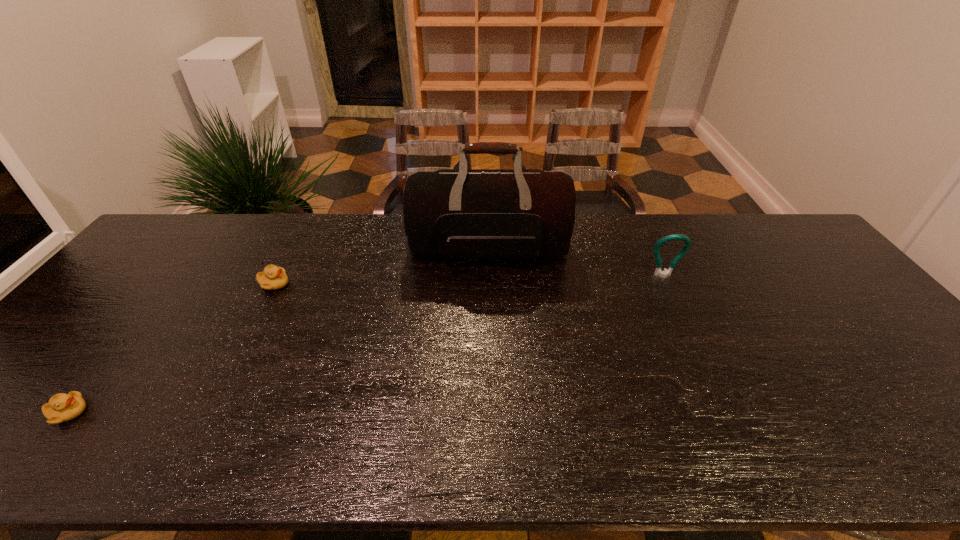
Find the location of a particular element. The height and width of the screenshot is (540, 960). free location at the far right corner of the desktop is located at coordinates (810, 255).

The image size is (960, 540). In order to click on free space between the leftmost object and the second tallest object in this screenshot , I will do `click(366, 345)`.

Identify the location of free space between the nearest object and the second tallest object. The image size is (960, 540). (366, 345).

Locate an element on the screen. Image resolution: width=960 pixels, height=540 pixels. blank region between the farther duckling and the nearer duckling is located at coordinates (171, 348).

Identify the location of free point between the bottle opener and the duffel bag. The image size is (960, 540). (576, 262).

Find the location of a particular element. free point between the tallest object and the right duckling is located at coordinates (382, 266).

Identify the location of vacant space that's between the second tallest object and the leftmost object. (366, 345).

This screenshot has width=960, height=540. Identify the location of empty space between the left duckling and the rightmost object. (366, 345).

Locate an element on the screen. Image resolution: width=960 pixels, height=540 pixels. vacant space in between the right duckling and the leftmost object is located at coordinates (171, 348).

At what (x,y) coordinates should I click in order to perform the action: click on vacant area between the second object from right to left and the right duckling. Please return your answer as a coordinate pair (x, y). The width and height of the screenshot is (960, 540). Looking at the image, I should click on (382, 266).